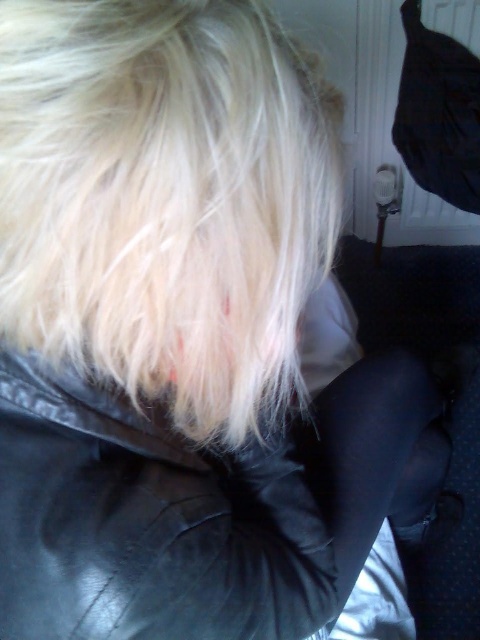
Looking at this image, how distant is blonde hair at upper center from black leather jacket at center?

blonde hair at upper center and black leather jacket at center are 11.58 centimeters apart.

Which of these two, blonde hair at upper center or black leather jacket at center, stands shorter?

blonde hair at upper center

Where is `blonde hair at upper center`? blonde hair at upper center is located at coordinates (165, 198).